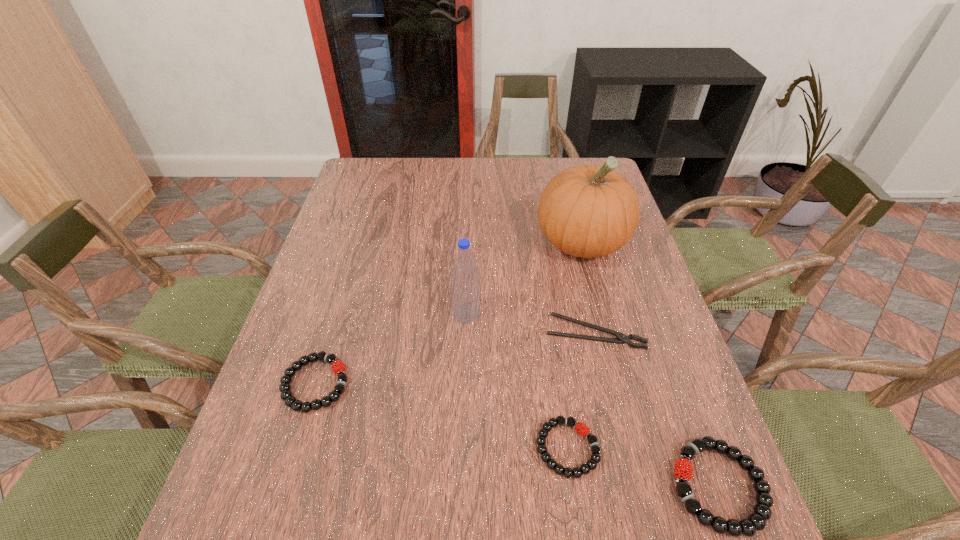
Find the location of `blank region between the pumpkin and the second object from left to right`. blank region between the pumpkin and the second object from left to right is located at coordinates (524, 278).

What are the coordinates of `vacant area that lies between the fifth object from right to left and the second bracelet from right to left` in the screenshot? It's located at (516, 381).

Where is `empty space between the rightmost bracelet and the fourth tallest object`? The image size is (960, 540). empty space between the rightmost bracelet and the fourth tallest object is located at coordinates (516, 435).

The image size is (960, 540). In order to click on unoccupied area between the second bracelet from left to right and the water bottle in this screenshot , I will do `click(516, 381)`.

At what (x,y) coordinates should I click in order to perform the action: click on free spot between the pumpkin and the second bracelet from left to right. Please return your answer as a coordinate pair (x, y). The height and width of the screenshot is (540, 960). Looking at the image, I should click on [x=574, y=345].

You are a GUI agent. You are given a task and a screenshot of the screen. Output one action in this format:
    pyautogui.click(x=<x>, y=<y>)
    Task: Click on the free space between the rightmost bracelet and the tallest object
    Image resolution: width=960 pixels, height=540 pixels.
    Given the screenshot: What is the action you would take?
    pyautogui.click(x=650, y=364)

Where is `object that is the nearest to the rightmost bracelet`? The height and width of the screenshot is (540, 960). object that is the nearest to the rightmost bracelet is located at coordinates (584, 431).

Identify the location of object that is the fourth closest to the fifth shortest object. (584, 431).

Locate which bracelet ranks in proximity to the tallest object. Please provide its 2D coordinates. Your answer should be formatted as a tuple, i.e. [(x, y)], where the tuple contains the x and y coordinates of a point satisfying the conditions above.

[(584, 431)]

Identify the location of bracelet that can be found as the second closest to the fourth farthest object. The height and width of the screenshot is (540, 960). (756, 521).